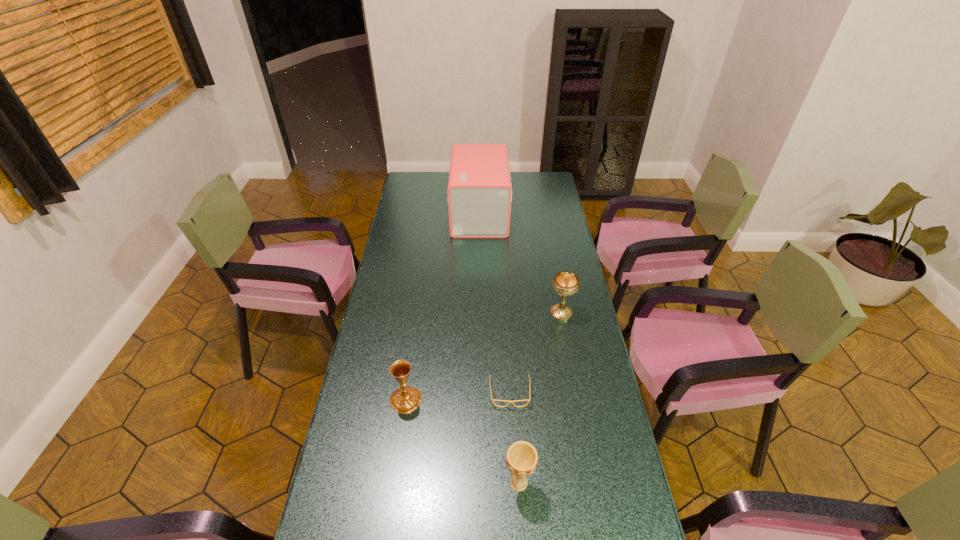
Identify the location of the farthest object. (479, 192).

You are a GUI agent. You are given a task and a screenshot of the screen. Output one action in this format:
    pyautogui.click(x=<x>, y=<y>)
    Task: Click on the tallest object
    Image resolution: width=960 pixels, height=540 pixels.
    Given the screenshot: What is the action you would take?
    pyautogui.click(x=479, y=192)

At what (x,y) coordinates should I click in order to perform the action: click on the second farthest object. Please return your answer as a coordinate pair (x, y). The image size is (960, 540). Looking at the image, I should click on (565, 283).

At what (x,y) coordinates should I click in order to perform the action: click on the farthest chalice. Please return your answer as a coordinate pair (x, y). Looking at the image, I should click on (565, 283).

This screenshot has width=960, height=540. I want to click on the leftmost chalice, so click(x=406, y=399).

In order to click on the leftmost object in this screenshot , I will do 406,399.

What are the coordinates of `the nearest object` in the screenshot? It's located at (521, 458).

Locate an element on the screen. This screenshot has height=540, width=960. the second chalice from left to right is located at coordinates (521, 458).

Where is `the shortest object`? Image resolution: width=960 pixels, height=540 pixels. the shortest object is located at coordinates (528, 374).

In order to click on vacant position located 0.140m on the surface of the farthest object where the text is embossed in this screenshot , I will do `click(537, 213)`.